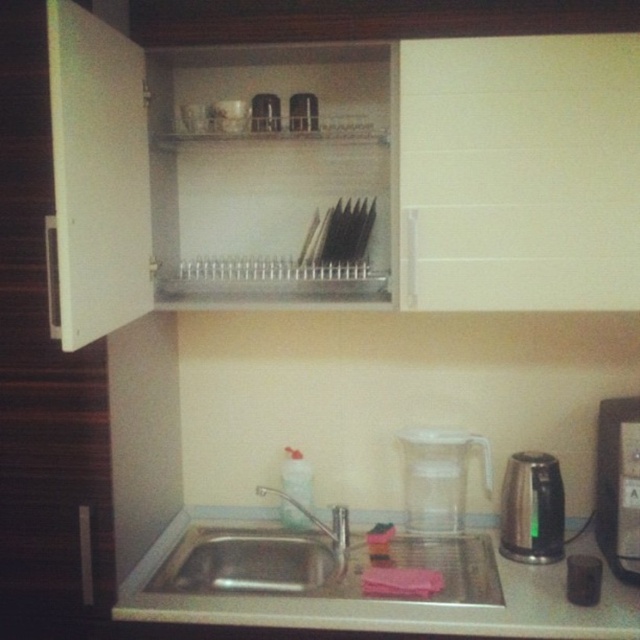
Can you confirm if black plastic coffee machine at right is smaller than transparent plastic pitcher at lower center?

No, black plastic coffee machine at right is not smaller than transparent plastic pitcher at lower center.

The width and height of the screenshot is (640, 640). What do you see at coordinates (618, 486) in the screenshot?
I see `black plastic coffee machine at right` at bounding box center [618, 486].

At what (x,y) coordinates should I click in order to perform the action: click on black plastic coffee machine at right. Please return your answer as a coordinate pair (x, y). Looking at the image, I should click on (618, 486).

Which of these two, white glossy counter top at lower center or stainless steel sink at lower center, stands shorter?

With less height is white glossy counter top at lower center.

Who is more distant from viewer, (x=516, y=563) or (x=284, y=547)?

The point (x=284, y=547) is behind.

Locate an element on the screen. Image resolution: width=640 pixels, height=640 pixels. white glossy counter top at lower center is located at coordinates (392, 604).

Which of these two, white glossy counter top at lower center or transparent plastic pitcher at lower center, stands shorter?

Standing shorter between the two is white glossy counter top at lower center.

Does white glossy counter top at lower center have a smaller size compared to transparent plastic pitcher at lower center?

No, white glossy counter top at lower center is not smaller than transparent plastic pitcher at lower center.

This screenshot has width=640, height=640. Find the location of `white glossy counter top at lower center`. white glossy counter top at lower center is located at coordinates (392, 604).